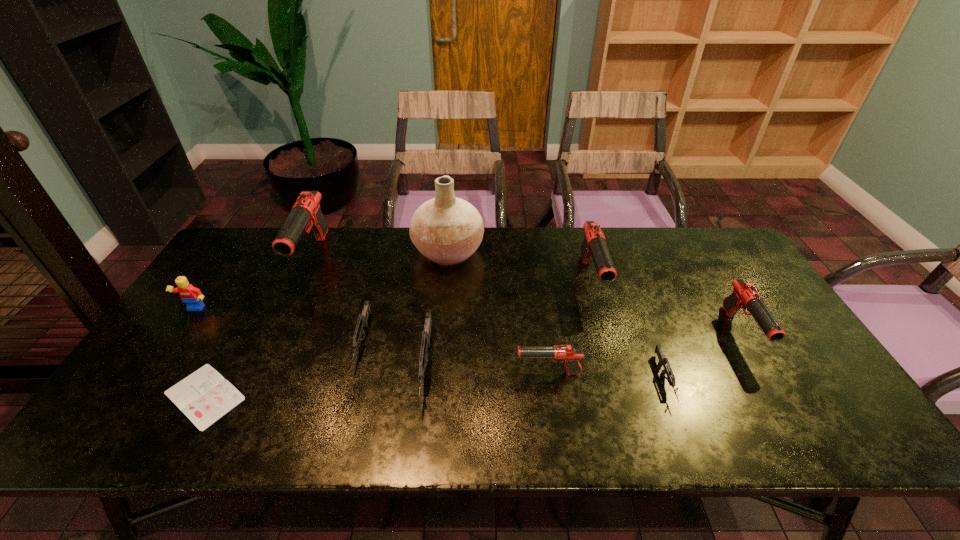
In the image, there is a desktop. Where is `vacant space at the right edge`? The image size is (960, 540). vacant space at the right edge is located at coordinates (731, 323).

This screenshot has height=540, width=960. In the image, there is a desktop. What are the coordinates of `free space at the far right corner` in the screenshot? It's located at (718, 239).

The height and width of the screenshot is (540, 960). I want to click on vacant region between the ninth object from left to right and the tallest gun, so click(489, 319).

Where is `free spot between the second grey gun from right to left and the Lego`? The image size is (960, 540). free spot between the second grey gun from right to left and the Lego is located at coordinates (311, 339).

You are a GUI agent. You are given a task and a screenshot of the screen. Output one action in this format:
    pyautogui.click(x=<x>, y=<y>)
    Task: Click on the vacant area between the rightmost black gun and the tallest object
    This screenshot has height=540, width=960.
    Given the screenshot: What is the action you would take?
    pyautogui.click(x=594, y=292)

This screenshot has height=540, width=960. In order to click on empty space that is in between the Lego and the second tallest object in this screenshot , I will do `click(254, 284)`.

This screenshot has height=540, width=960. In order to click on vacant space in between the rightmost object and the third smallest black gun in this screenshot , I will do `click(665, 307)`.

Image resolution: width=960 pixels, height=540 pixels. I want to click on vacant region between the seventh object from right to left and the third smallest black gun, so click(x=476, y=311).

This screenshot has width=960, height=540. I want to click on blank region between the rightmost gun and the ninth shortest object, so click(x=527, y=295).

Where is `free space between the reddish-brown pottery and the fourth shortest object`? This screenshot has width=960, height=540. free space between the reddish-brown pottery and the fourth shortest object is located at coordinates [437, 309].